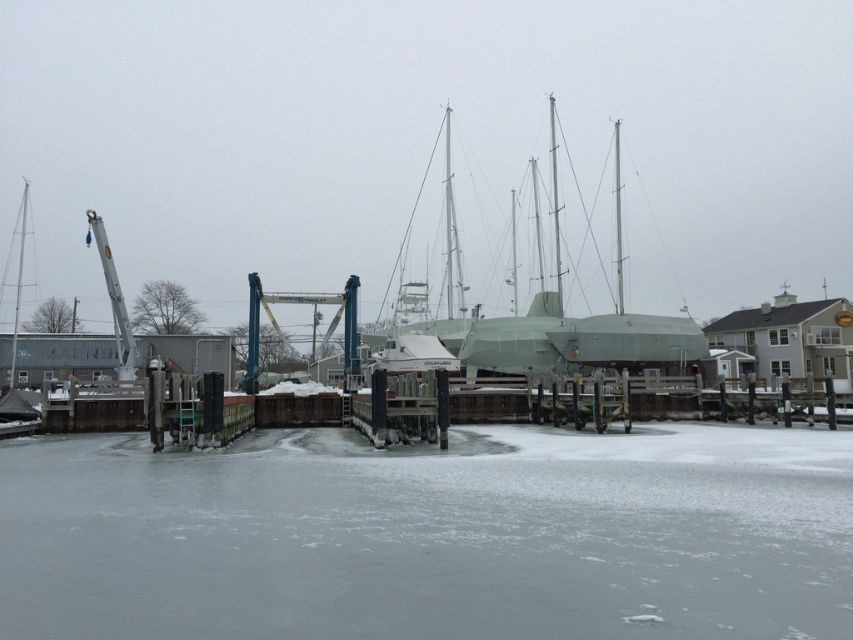
Question: From the image, what is the correct spatial relationship of frozen ice at lower center in relation to blue metallic crane at center?

Choices:
 (A) below
 (B) above

Answer: (A)

Question: Among these objects, which one is farthest from the camera?

Choices:
 (A) green matte sailboat at center
 (B) blue metallic crane at center

Answer: (A)

Question: Is frozen ice at lower center to the right of blue metallic crane at center from the viewer's perspective?

Choices:
 (A) yes
 (B) no

Answer: (A)

Question: Which point is closer to the camera?

Choices:
 (A) (463, 333)
 (B) (300, 292)
 (C) (834, 612)

Answer: (C)

Question: Can you confirm if green matte sailboat at center is positioned below blue metallic crane at center?

Choices:
 (A) no
 (B) yes

Answer: (A)

Question: Based on their relative distances, which object is nearer to the frozen ice at lower center?

Choices:
 (A) green matte sailboat at center
 (B) blue metallic crane at center

Answer: (B)